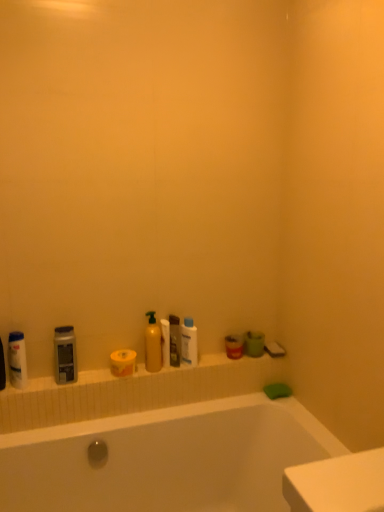
Measure the distance between matte yellow bottle at center, which is counted as the 2th cleaning product, starting from the left, and camera.

The distance of matte yellow bottle at center, which is counted as the 2th cleaning product, starting from the left, from camera is 1.75 meters.

Describe the element at coordinates (153, 344) in the screenshot. I see `matte yellow bottle at center, which is counted as the 2th cleaning product, starting from the left` at that location.

What do you see at coordinates (165, 342) in the screenshot?
I see `white matte toilet paper at center, the 2th toilet paper when ordered from left to right` at bounding box center [165, 342].

The image size is (384, 512). What are the coordinates of `matte plastic mouthwash at center, the 1th mouthwash viewed from the back` in the screenshot? It's located at (234, 346).

Identify the location of matte gray bottle at left, which is counted as the first cleaning product, starting from the left. (65, 355).

Locate an element on the screen. This screenshot has height=512, width=384. translucent plastic bottle at center, arranged as the 1th cleaning product when viewed from the right is located at coordinates (175, 340).

Describe the element at coordinates (123, 362) in the screenshot. I see `yellow matte toilet paper at center, acting as the 1th toilet paper starting from the left` at that location.

What do you see at coordinates (17, 360) in the screenshot?
I see `white matte bottle at left, positioned as the first mouthwash in left-to-right order` at bounding box center [17, 360].

Locate an element on the screen. The height and width of the screenshot is (512, 384). white glossy bottle at center is located at coordinates (189, 343).

Where is `matte yellow bottle at center, which is counted as the 2th cleaning product, starting from the left`? The height and width of the screenshot is (512, 384). matte yellow bottle at center, which is counted as the 2th cleaning product, starting from the left is located at coordinates point(153,344).

From their relative heights in the image, would you say translucent plastic bottle at center, arranged as the 1th cleaning product when viewed from the right, is taller or shorter than matte yellow bottle at center, which is counted as the 2th cleaning product, starting from the left?

Clearly, translucent plastic bottle at center, arranged as the 1th cleaning product when viewed from the right, is shorter compared to matte yellow bottle at center, which is counted as the 2th cleaning product, starting from the left.

Is matte yellow bottle at center, which is counted as the 2th cleaning product, starting from the left, surrounded by translucent plastic bottle at center, arranged as the 1th cleaning product when viewed from the right?

That's incorrect, matte yellow bottle at center, which is counted as the 2th cleaning product, starting from the left, is not inside translucent plastic bottle at center, arranged as the 1th cleaning product when viewed from the right.

Considering the sizes of objects translucent plastic bottle at center, which ranks as the 3th cleaning product in left-to-right order, and matte yellow bottle at center, which is counted as the 2th cleaning product, starting from the left, in the image provided, who is wider, translucent plastic bottle at center, which ranks as the 3th cleaning product in left-to-right order, or matte yellow bottle at center, which is counted as the 2th cleaning product, starting from the left,?

matte yellow bottle at center, which is counted as the 2th cleaning product, starting from the left, is wider.

Could you tell me if translucent plastic bottle at center, arranged as the 1th cleaning product when viewed from the right, is turned towards matte yellow bottle at center, which is counted as the 2th cleaning product, starting from the left?

No.

Is matte gray bottle at left, which is counted as the first cleaning product, starting from the left, facing away from yellow matte toilet paper at center, marked as the second toilet paper in a right-to-left arrangement?

No, matte gray bottle at left, which is counted as the first cleaning product, starting from the left,'s orientation is not away from yellow matte toilet paper at center, marked as the second toilet paper in a right-to-left arrangement.

Considering the positions of objects matte gray bottle at left, which ranks as the third cleaning product in right-to-left order, and yellow matte toilet paper at center, acting as the 1th toilet paper starting from the left, in the image provided, who is behind, matte gray bottle at left, which ranks as the third cleaning product in right-to-left order, or yellow matte toilet paper at center, acting as the 1th toilet paper starting from the left,?

yellow matte toilet paper at center, acting as the 1th toilet paper starting from the left, is more distant.

Consider the image. Can you confirm if matte gray bottle at left, which is counted as the first cleaning product, starting from the left, is wider than yellow matte toilet paper at center, acting as the 1th toilet paper starting from the left?

No.

From a real-world perspective, which object stands above the other?

In real-world perspective, matte gray bottle at left, which ranks as the third cleaning product in right-to-left order, is above.

Considering the relative positions of matte plastic mouthwash at center, which is the 2th mouthwash from front to back, and translucent plastic bottle at center, which ranks as the 3th cleaning product in left-to-right order, in the image provided, is matte plastic mouthwash at center, which is the 2th mouthwash from front to back, to the right of translucent plastic bottle at center, which ranks as the 3th cleaning product in left-to-right order, from the viewer's perspective?

Yes, matte plastic mouthwash at center, which is the 2th mouthwash from front to back, is to the right of translucent plastic bottle at center, which ranks as the 3th cleaning product in left-to-right order.

From the image's perspective, count 2nd mouthwashs downward from the translucent plastic bottle at center, arranged as the 1th cleaning product when viewed from the right, and point to it. Please provide its 2D coordinates.

[(234, 346)]

From the image's perspective, is matte plastic mouthwash at center, the 1th mouthwash viewed from the back, located beneath translucent plastic bottle at center, arranged as the 1th cleaning product when viewed from the right?

Yes, from the image's perspective, matte plastic mouthwash at center, the 1th mouthwash viewed from the back, is beneath translucent plastic bottle at center, arranged as the 1th cleaning product when viewed from the right.

Does point (239, 351) appear closer or farther from the camera than point (173, 326)?

Point (239, 351) appears to be farther away from the viewer than point (173, 326).

In the scene shown: From the image's perspective, who appears lower, yellow matte toilet paper at center, marked as the second toilet paper in a right-to-left arrangement, or white matte toilet paper at center, which is the 1th toilet paper from right to left?

yellow matte toilet paper at center, marked as the second toilet paper in a right-to-left arrangement.

Can you tell me how much yellow matte toilet paper at center, marked as the second toilet paper in a right-to-left arrangement, and white matte toilet paper at center, which is the 1th toilet paper from right to left, differ in facing direction?

They differ by 0.000324 degrees in their facing directions.

Is yellow matte toilet paper at center, acting as the 1th toilet paper starting from the left, shorter than white matte toilet paper at center, the 2th toilet paper when ordered from left to right?

Yes, yellow matte toilet paper at center, acting as the 1th toilet paper starting from the left, is shorter than white matte toilet paper at center, the 2th toilet paper when ordered from left to right.

Is yellow matte toilet paper at center, acting as the 1th toilet paper starting from the left, not within white matte toilet paper at center, which is the 1th toilet paper from right to left?

Yes, yellow matte toilet paper at center, acting as the 1th toilet paper starting from the left, is located beyond the bounds of white matte toilet paper at center, which is the 1th toilet paper from right to left.

From their relative heights in the image, would you say translucent plastic bottle at center, which ranks as the 3th cleaning product in left-to-right order, is taller or shorter than white matte bottle at left, which ranks as the 2th mouthwash in right-to-left order?

In the image, translucent plastic bottle at center, which ranks as the 3th cleaning product in left-to-right order, appears to be taller than white matte bottle at left, which ranks as the 2th mouthwash in right-to-left order.

From the image's perspective, is translucent plastic bottle at center, arranged as the 1th cleaning product when viewed from the right, over white matte bottle at left, which ranks as the 2th mouthwash in right-to-left order?

Correct, translucent plastic bottle at center, arranged as the 1th cleaning product when viewed from the right, appears higher than white matte bottle at left, which ranks as the 2th mouthwash in right-to-left order, in the image.

From their relative heights in the image, would you say white matte bottle at left, positioned as the first mouthwash in left-to-right order, is taller or shorter than yellow matte toilet paper at center, acting as the 1th toilet paper starting from the left?

Considering their sizes, white matte bottle at left, positioned as the first mouthwash in left-to-right order, has more height than yellow matte toilet paper at center, acting as the 1th toilet paper starting from the left.

From the image's perspective, which object appears higher, white matte bottle at left, placed as the first mouthwash when sorted from front to back, or yellow matte toilet paper at center, marked as the second toilet paper in a right-to-left arrangement?

From the image's view, white matte bottle at left, placed as the first mouthwash when sorted from front to back, is above.

Is white matte bottle at left, placed as the first mouthwash when sorted from front to back, oriented towards yellow matte toilet paper at center, marked as the second toilet paper in a right-to-left arrangement?

No.

Is white matte bottle at left, which appears as the 2th mouthwash when viewed from the back, in front of yellow matte toilet paper at center, marked as the second toilet paper in a right-to-left arrangement?

Yes, it is.

Is translucent plastic bottle at center, which ranks as the 3th cleaning product in left-to-right order, closer to the viewer compared to white matte toilet paper at center, the 2th toilet paper when ordered from left to right?

No, the depth of translucent plastic bottle at center, which ranks as the 3th cleaning product in left-to-right order, is greater than that of white matte toilet paper at center, the 2th toilet paper when ordered from left to right.

Can you see translucent plastic bottle at center, which ranks as the 3th cleaning product in left-to-right order, touching white matte toilet paper at center, the 2th toilet paper when ordered from left to right?

Yes, translucent plastic bottle at center, which ranks as the 3th cleaning product in left-to-right order, is right next to white matte toilet paper at center, the 2th toilet paper when ordered from left to right, and making contact.

Could white matte toilet paper at center, the 2th toilet paper when ordered from left to right, be considered to be inside translucent plastic bottle at center, which ranks as the 3th cleaning product in left-to-right order?

No, white matte toilet paper at center, the 2th toilet paper when ordered from left to right, is not inside translucent plastic bottle at center, which ranks as the 3th cleaning product in left-to-right order.

Can you confirm if translucent plastic bottle at center, which ranks as the 3th cleaning product in left-to-right order, is thinner than white matte toilet paper at center, which is the 1th toilet paper from right to left?

No.

At what (x,y) coordinates should I click in order to perform the action: click on cleaning product behind the matte yellow bottle at center, the second cleaning product from the right. Please return your answer as a coordinate pair (x, y). Looking at the image, I should click on (175, 340).

What are the coordinates of `the 2nd cleaning product positioned above the yellow matte toilet paper at center, acting as the 1th toilet paper starting from the left (from a real-world perspective)` in the screenshot? It's located at (65, 355).

Which object lies nearer to the anchor point white matte toilet paper at center, the 2th toilet paper when ordered from left to right, matte yellow bottle at center, which is counted as the 2th cleaning product, starting from the left, or white matte bottle at left, placed as the first mouthwash when sorted from front to back?

The object closer to white matte toilet paper at center, the 2th toilet paper when ordered from left to right, is matte yellow bottle at center, which is counted as the 2th cleaning product, starting from the left.

From the image, which object appears to be farther from translucent plastic bottle at center, which ranks as the 3th cleaning product in left-to-right order, white matte bottle at left, placed as the first mouthwash when sorted from front to back, or white glossy bottle at center?

white matte bottle at left, placed as the first mouthwash when sorted from front to back, is positioned further to the anchor translucent plastic bottle at center, which ranks as the 3th cleaning product in left-to-right order.

Looking at the image, which one is located further to white glossy bottle at center, white matte toilet paper at center, the 2th toilet paper when ordered from left to right, or matte plastic mouthwash at center, the 2th mouthwash when ordered from left to right?

matte plastic mouthwash at center, the 2th mouthwash when ordered from left to right, lies further to white glossy bottle at center than the other object.

Based on their spatial positions, is white matte bottle at left, positioned as the first mouthwash in left-to-right order, or matte yellow bottle at center, which is counted as the 2th cleaning product, starting from the left, further from matte gray bottle at left, which ranks as the third cleaning product in right-to-left order?

matte yellow bottle at center, which is counted as the 2th cleaning product, starting from the left, is further to matte gray bottle at left, which ranks as the third cleaning product in right-to-left order.

Considering their positions, is yellow matte toilet paper at center, marked as the second toilet paper in a right-to-left arrangement, positioned further to matte gray bottle at left, which is counted as the first cleaning product, starting from the left, than white matte toilet paper at center, the 2th toilet paper when ordered from left to right?

white matte toilet paper at center, the 2th toilet paper when ordered from left to right, lies further to matte gray bottle at left, which is counted as the first cleaning product, starting from the left, than the other object.

From the image, which object appears to be farther from matte plastic mouthwash at center, which is the 2th mouthwash from front to back, yellow matte toilet paper at center, marked as the second toilet paper in a right-to-left arrangement, or white matte bottle at left, placed as the first mouthwash when sorted from front to back?

white matte bottle at left, placed as the first mouthwash when sorted from front to back, is further to matte plastic mouthwash at center, which is the 2th mouthwash from front to back.

Estimate the real-world distances between objects in this image. Which object is closer to white matte bottle at left, placed as the first mouthwash when sorted from front to back, matte plastic mouthwash at center, which is the 2th mouthwash from front to back, or matte gray bottle at left, which ranks as the third cleaning product in right-to-left order?

Based on the image, matte gray bottle at left, which ranks as the third cleaning product in right-to-left order, appears to be nearer to white matte bottle at left, placed as the first mouthwash when sorted from front to back.

Based on their spatial positions, is white matte toilet paper at center, the 2th toilet paper when ordered from left to right, or yellow matte toilet paper at center, marked as the second toilet paper in a right-to-left arrangement, closer to white matte bottle at left, which ranks as the 2th mouthwash in right-to-left order?

yellow matte toilet paper at center, marked as the second toilet paper in a right-to-left arrangement, is closer to white matte bottle at left, which ranks as the 2th mouthwash in right-to-left order.

This screenshot has width=384, height=512. Identify the location of toilet paper between white matte bottle at left, which ranks as the 2th mouthwash in right-to-left order, and matte yellow bottle at center, which is counted as the 2th cleaning product, starting from the left, from left to right. (123, 362).

Identify the location of cleaning product between white matte bottle at left, which appears as the 2th mouthwash when viewed from the back, and matte yellow bottle at center, which is counted as the 2th cleaning product, starting from the left, in the horizontal direction. Image resolution: width=384 pixels, height=512 pixels. (65, 355).

Locate an element on the screen. The image size is (384, 512). cleaning product located between matte yellow bottle at center, the second cleaning product from the right, and matte plastic mouthwash at center, the 1th mouthwash viewed from the back, in the left-right direction is located at coordinates (175, 340).

Locate an element on the screen. The width and height of the screenshot is (384, 512). cleaning product between yellow matte toilet paper at center, marked as the second toilet paper in a right-to-left arrangement, and translucent plastic bottle at center, arranged as the 1th cleaning product when viewed from the right, in the horizontal direction is located at coordinates (153, 344).